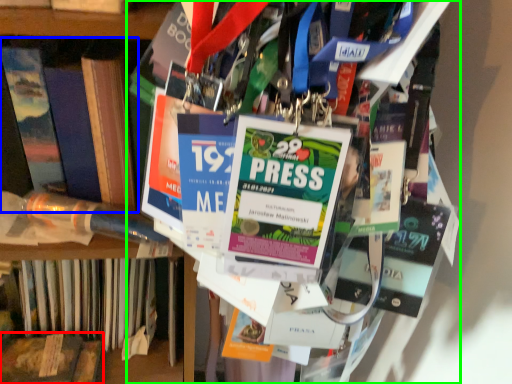
Question: Which object is the farthest from book (highlighted by a red box)? Choose among these: book (highlighted by a blue box) or book (highlighted by a green box).

Choices:
 (A) book
 (B) book

Answer: (B)